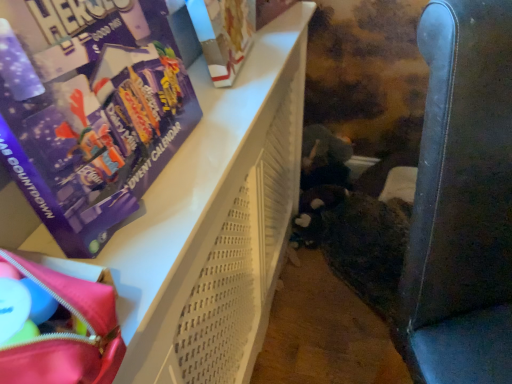
Question: From the image's perspective, is purple cardboard advent calendar at upper left above or below leather-like dark blue armchair at right?

Choices:
 (A) below
 (B) above

Answer: (B)

Question: Is point (165, 9) positioned closer to the camera than point (499, 344)?

Choices:
 (A) closer
 (B) farther

Answer: (A)

Question: Which object is the closest to the white perforated plastic basket at upper left?

Choices:
 (A) matte pink fabric bag at lower left
 (B) white cardboard book at upper center
 (C) purple cardboard advent calendar at upper left
 (D) leather-like dark blue armchair at right

Answer: (C)

Question: Considering the real-world distances, which object is closest to the leather-like dark blue armchair at right?

Choices:
 (A) purple cardboard advent calendar at upper left
 (B) white perforated plastic basket at upper left
 (C) white cardboard book at upper center
 (D) matte pink fabric bag at lower left

Answer: (B)